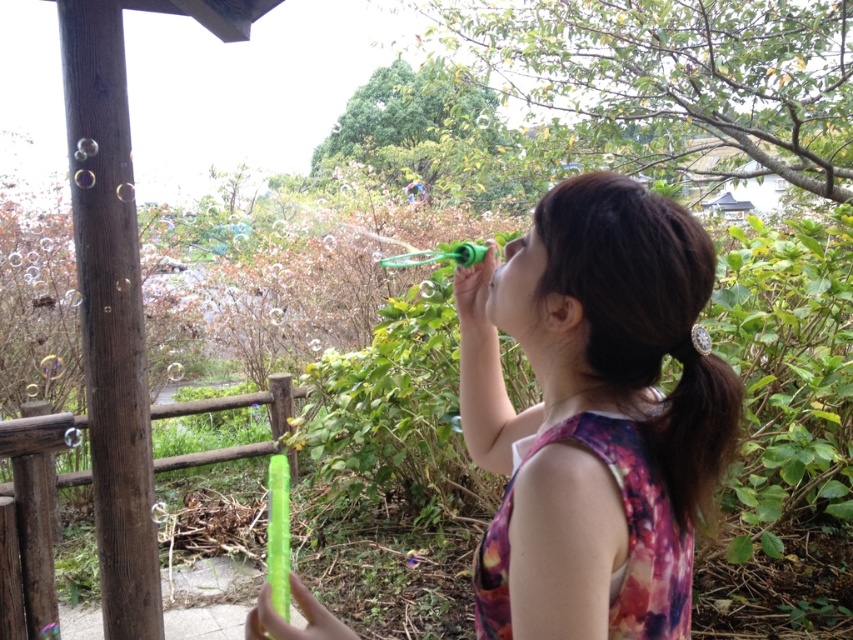
You are standing in the garden scene and want to place a small decoration between the two points, point (276, 403) and point (706, 426). Which point is closer to you so you can start placing the decoration from there?

Point (276, 403) is closer to you than point (706, 426), so you should start placing the decoration from point (276, 403).

Looking at this image, you are holding a 10 cm tall toy soldier and want to place it on either the matte green bubble wand at center or the green plastic rail at center. Which object can the toy soldier fit on top of without falling off?

The matte green bubble wand at center has a lesser height compared to green plastic rail at center, so the toy soldier can fit on the green plastic rail at center since it is taller and provides a stable surface.